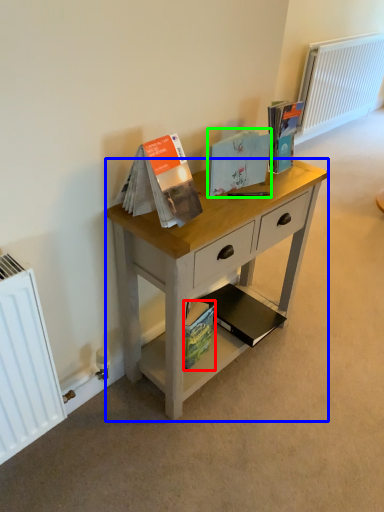
Question: Based on their relative distances, which object is nearer to paperback book (highlighted by a red box)? Choose from desk (highlighted by a blue box) and paperback book (highlighted by a green box).

Choices:
 (A) desk
 (B) paperback book

Answer: (A)